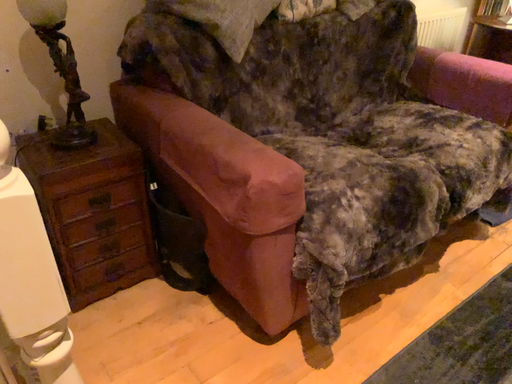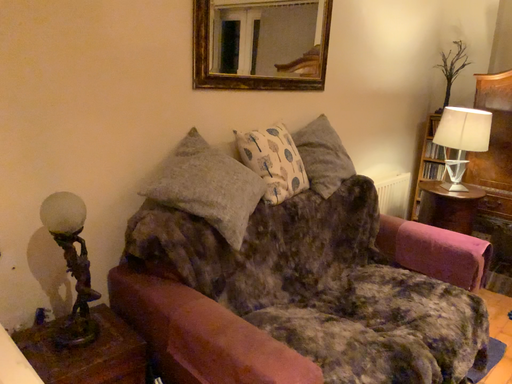
Question: How did the camera likely rotate when shooting the video?

Choices:
 (A) rotated left
 (B) rotated right

Answer: (B)